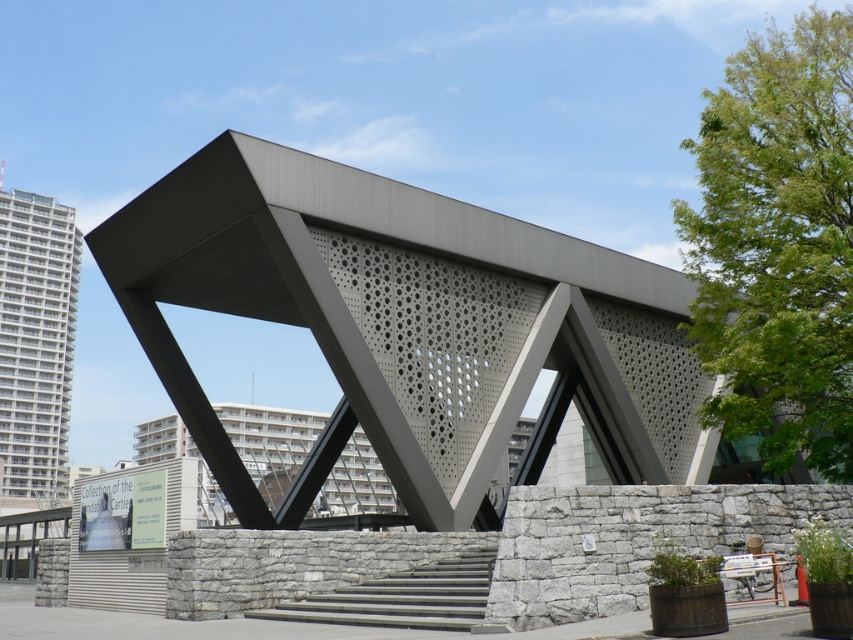
You are standing at the entrance of the white concrete building at left. What are the coordinates of the building?

The white concrete building at left is located at coordinates (36, 339).